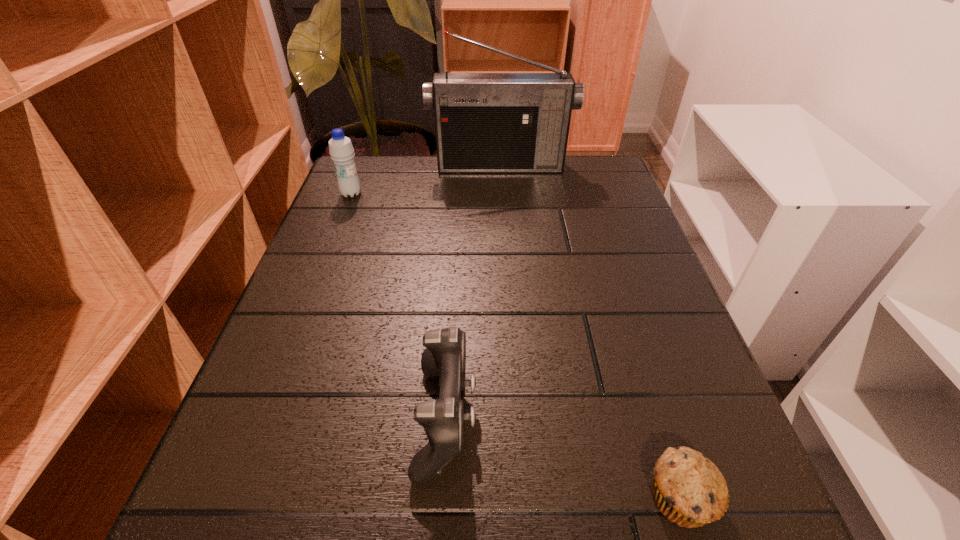
This screenshot has height=540, width=960. Find the location of `free space that satisfies the following two spatial constraints: 1. on the front-facing side of the farthest object; 2. on the surface of the third tallest object with buttons`. free space that satisfies the following two spatial constraints: 1. on the front-facing side of the farthest object; 2. on the surface of the third tallest object with buttons is located at coordinates (517, 418).

Where is `vacant space that satisfies the following two spatial constraints: 1. on the front-facing side of the farthest object; 2. on the left side of the muffin`? The height and width of the screenshot is (540, 960). vacant space that satisfies the following two spatial constraints: 1. on the front-facing side of the farthest object; 2. on the left side of the muffin is located at coordinates (522, 497).